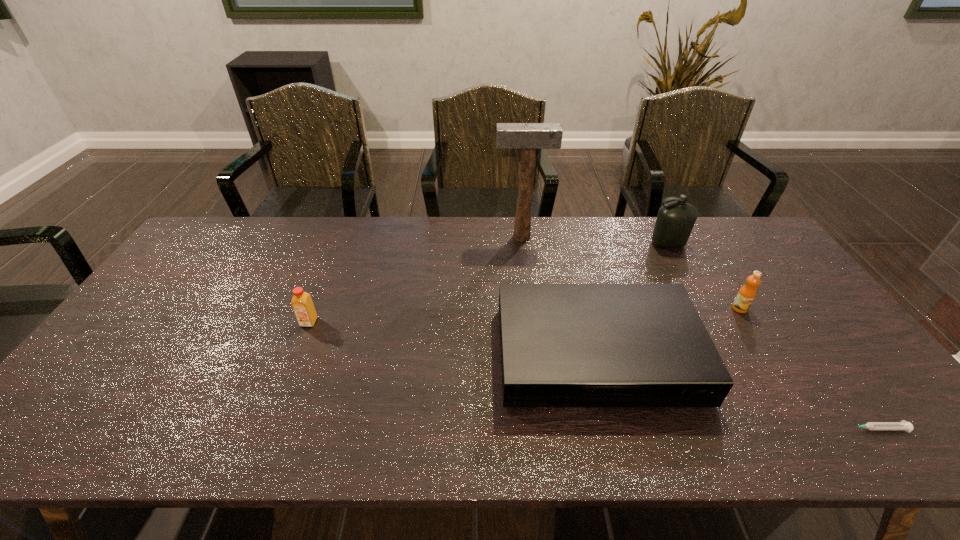
Find the location of a particular element. object located at the near edge is located at coordinates (903, 425).

The height and width of the screenshot is (540, 960). Identify the location of object that is at the right edge. (903, 425).

This screenshot has width=960, height=540. Find the location of `object present at the near right corner`. object present at the near right corner is located at coordinates (903, 425).

Locate an element on the screen. The image size is (960, 540). vacant space at the far edge of the desktop is located at coordinates (629, 239).

At what (x,y) coordinates should I click in order to perform the action: click on free space at the near edge of the desktop. Please return your answer as a coordinate pair (x, y). The image size is (960, 540). Looking at the image, I should click on (236, 446).

The height and width of the screenshot is (540, 960). In order to click on free space at the left edge of the desktop in this screenshot , I will do `click(96, 380)`.

In the image, there is a desktop. Identify the location of blank space at the right edge. (738, 266).

The width and height of the screenshot is (960, 540). Identify the location of free space at the far left corner. (235, 251).

Locate an element on the screen. This screenshot has height=540, width=960. free space between the farther orange juice and the shortest object is located at coordinates (808, 368).

Locate an element on the screen. The image size is (960, 540). vacant region between the left orange juice and the tallest object is located at coordinates (415, 280).